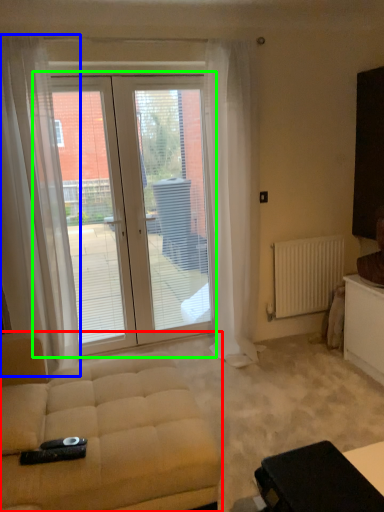
Question: Based on their relative distances, which object is farther from studio couch (highlighted by a red box)? Choose from curtain (highlighted by a blue box) and door (highlighted by a green box).

Choices:
 (A) curtain
 (B) door

Answer: (B)